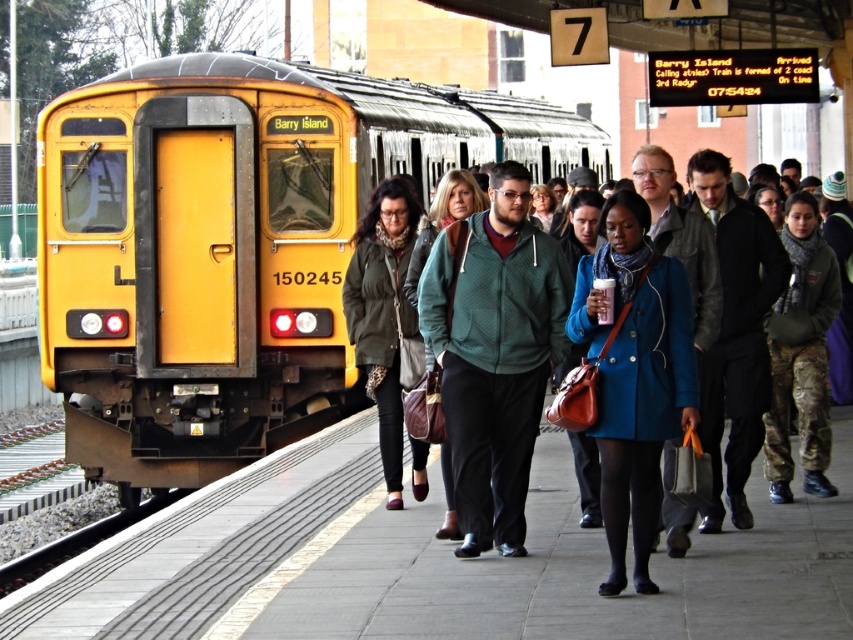
Can you confirm if yellow matte train at left is taller than camouflage pants at center?

Indeed, yellow matte train at left has a greater height compared to camouflage pants at center.

Which is in front, point (68, 282) or point (788, 448)?

Point (788, 448) is more forward.

Between point (170, 211) and point (804, 339), which one is positioned behind?

The point (170, 211) is more distant.

Locate an element on the screen. The image size is (853, 640). yellow matte train at left is located at coordinates (231, 244).

Can you confirm if yellow matte train at left is positioned below matte blue coat at center?

Actually, yellow matte train at left is above matte blue coat at center.

Is yellow matte train at left positioned behind matte blue coat at center?

Yes, it is.

At what (x,y) coordinates should I click in order to perform the action: click on yellow matte train at left. Please return your answer as a coordinate pair (x, y). Looking at the image, I should click on (231, 244).

Locate an element on the screen. The width and height of the screenshot is (853, 640). dark gray leather jacket at center is located at coordinates (735, 332).

Is dark gray leather jacket at center further to the viewer compared to green textured coat at center?

That is False.

The height and width of the screenshot is (640, 853). What do you see at coordinates (735, 332) in the screenshot?
I see `dark gray leather jacket at center` at bounding box center [735, 332].

At what (x,y) coordinates should I click in order to perform the action: click on dark gray leather jacket at center. Please return your answer as a coordinate pair (x, y). This screenshot has height=640, width=853. Looking at the image, I should click on (735, 332).